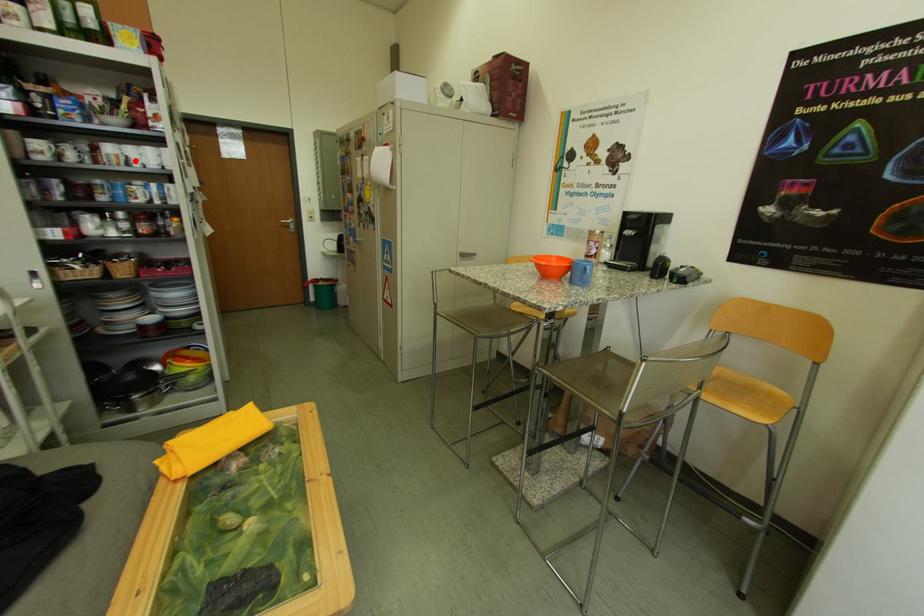
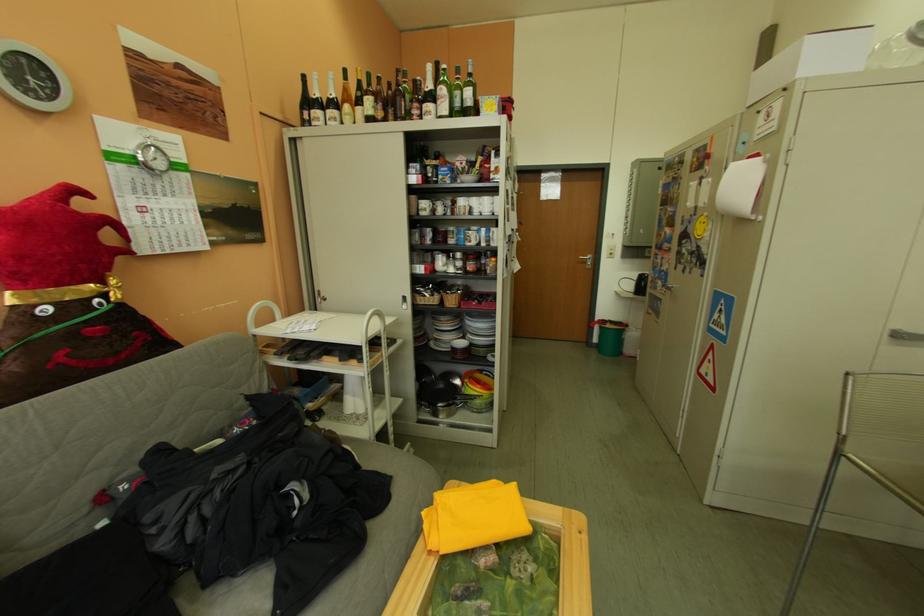
Question: I am providing you with two images of the same scene from different viewpoints. A red point is shown in image1. For the corresponding object point in image2, is it positioned nearer or farther from the camera?

Choices:
 (A) Nearer
 (B) Farther

Answer: (A)